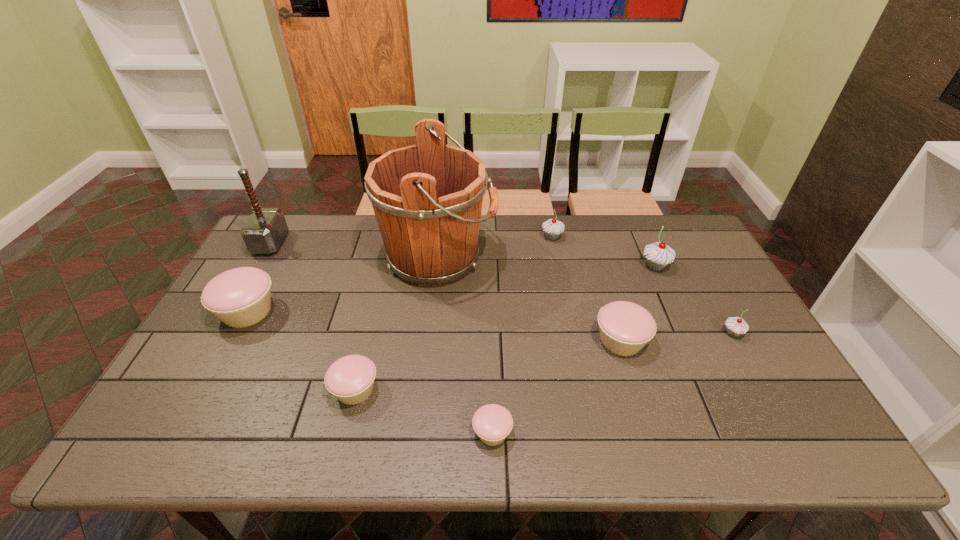
Find the location of a particular element. The height and width of the screenshot is (540, 960). empty space between the tallest cupcake and the nearest gray cupcake is located at coordinates (694, 300).

Find the location of a particular element. This screenshot has width=960, height=540. free spot between the fifth cupcake from right to left and the fourth object from right to left is located at coordinates (522, 335).

Find the location of `free area in between the fifth cupcake from right to left and the tallest object`. free area in between the fifth cupcake from right to left and the tallest object is located at coordinates (466, 345).

Locate an element on the screen. empty space between the second gray cupcake from left to right and the shortest cupcake is located at coordinates (574, 349).

This screenshot has width=960, height=540. Identify the location of vacant space that's between the bucket and the third tallest object. (547, 262).

At what (x,y) coordinates should I click in order to perform the action: click on vacant space that is in between the sixth object from left to right and the bucket. Please return your answer as a coordinate pair (x, y). The height and width of the screenshot is (540, 960). Looking at the image, I should click on tap(495, 248).

I want to click on empty space that is in between the leftmost cupcake and the third smallest pink cupcake, so click(434, 326).

Where is `vacant area that lies between the nearest object and the second shortest object`? vacant area that lies between the nearest object and the second shortest object is located at coordinates (423, 411).

Identify which object is the fifth nearest to the third tallest object. Please provide its 2D coordinates. Your answer should be formatted as a tuple, i.e. [(x, y)], where the tuple contains the x and y coordinates of a point satisfying the conditions above.

[(492, 423)]

Choose which object is the second nearest neighbor to the tallest cupcake. Please provide its 2D coordinates. Your answer should be formatted as a tuple, i.e. [(x, y)], where the tuple contains the x and y coordinates of a point satisfying the conditions above.

[(736, 326)]